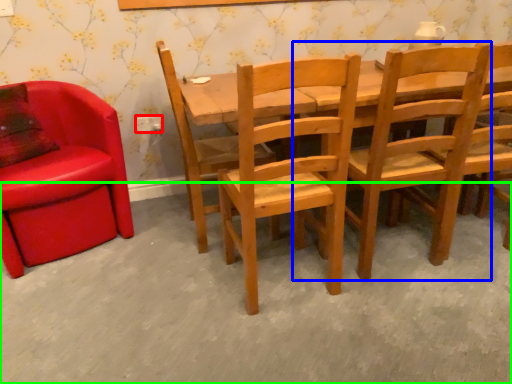
Question: Which is farther away from power outlet (highlighted by a red box)? chair (highlighted by a blue box) or concrete (highlighted by a green box)?

Choices:
 (A) chair
 (B) concrete

Answer: (A)